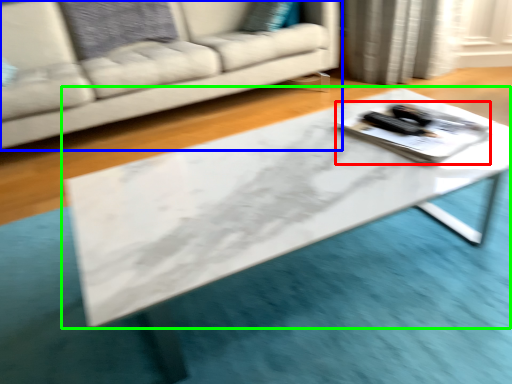
Question: Which object is positioned closest to tray (highlighted by a red box)? Select from studio couch (highlighted by a blue box) and table (highlighted by a green box).

Choices:
 (A) studio couch
 (B) table

Answer: (B)